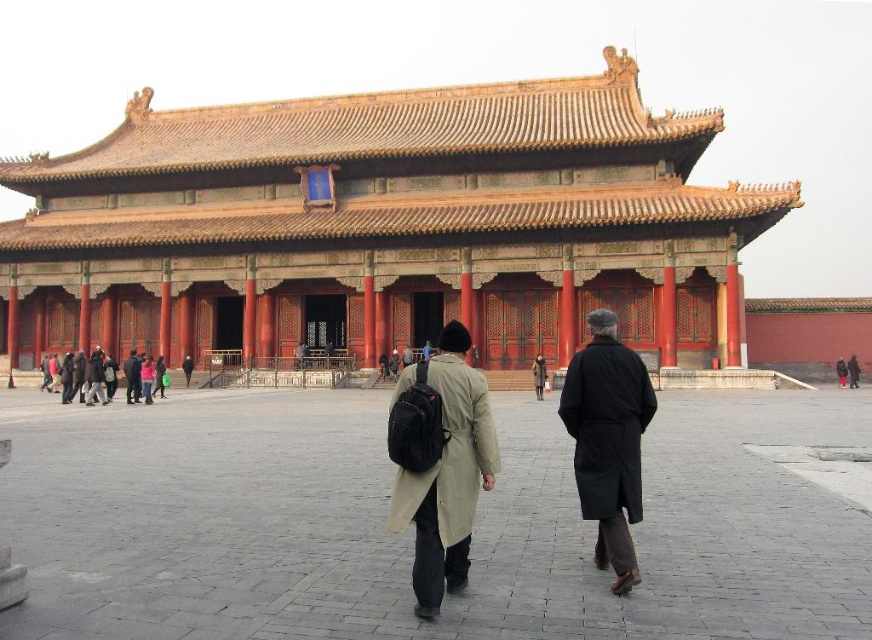
You are standing in front of the traditional Chinese architectural structure and want to take a photo of the matte orange wood palace at center. Where should you position yourself to capture the palace in the center of your photo?

To capture the matte orange wood palace at center in the center of your photo, you should position yourself directly in front of the palace, aligning your camera with the coordinates provided at point (x=386, y=227).

You are a tourist visiting the Forbidden City and see the matte orange wood palace at center and the dark gray wool coat at center. Which object is located to the right of the other?

The matte orange wood palace at center is positioned on the right side of dark gray wool coat at center.

You are a tourist standing in front of the traditional Chinese building. There is a point marked at coordinates [386,227]. Which object does this point correspond to?

The point at coordinates [386,227] corresponds to the matte orange wood palace at center.